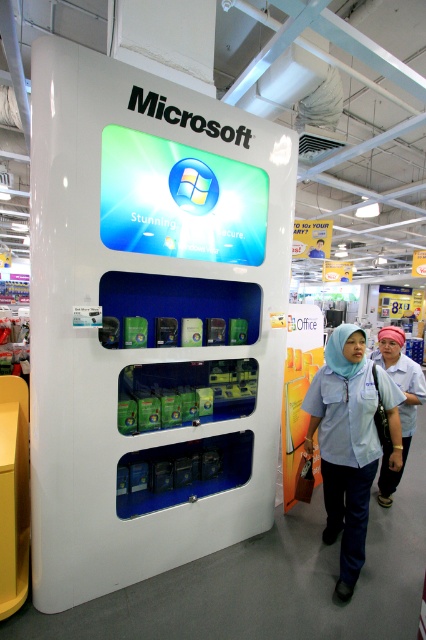
You are a customer in the store and want to buy both the light blue fabric shirt at center and the white fabric hijab at center. However, you have a small bag that can only hold items smaller than the hijab. Which item can you fit in your bag?

The light blue fabric shirt at center has a smaller size compared to the white fabric hijab at center, so you can fit the light blue fabric shirt at center in your bag.

You are a customer standing at the entrance of the store and want to purchase a product from the white plastic vending machine at center. The store has a rule that you must stay at least 2 meters away from any camera. Is the distance between you and the camera sufficient to comply with the store rule when you are at the vending machine?

The white plastic vending machine at center and the camera are 2.20 meters apart. Since the required distance is at least 2 meters, the distance is sufficient to comply with the store rule.

You are a customer standing in front of the Microsoft retail display stand. There is a specific point at coordinates point (192,378) that you want to reach. Can you estimate how far you need to walk from your current position to reach that point?

The distance between point (192,378) and the viewer is 3.34 meters, so you need to walk approximately 3.34 meters to reach that point.